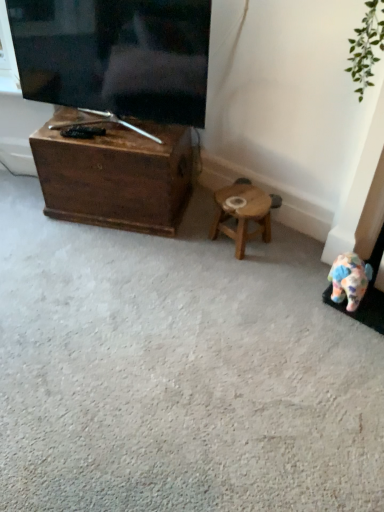
Question: From the image's perspective, is matte black tv at upper left positioned above or below wooden chest at left?

Choices:
 (A) below
 (B) above

Answer: (B)

Question: Based on their sizes in the image, would you say matte black tv at upper left is bigger or smaller than wooden chest at left?

Choices:
 (A) big
 (B) small

Answer: (B)

Question: Which of these objects is positioned farthest from the wooden chest at left?

Choices:
 (A) matte black tv at upper left
 (B) wooden stool at center

Answer: (B)

Question: Which is farther from the matte black tv at upper left?

Choices:
 (A) wooden stool at center
 (B) wooden chest at left

Answer: (A)